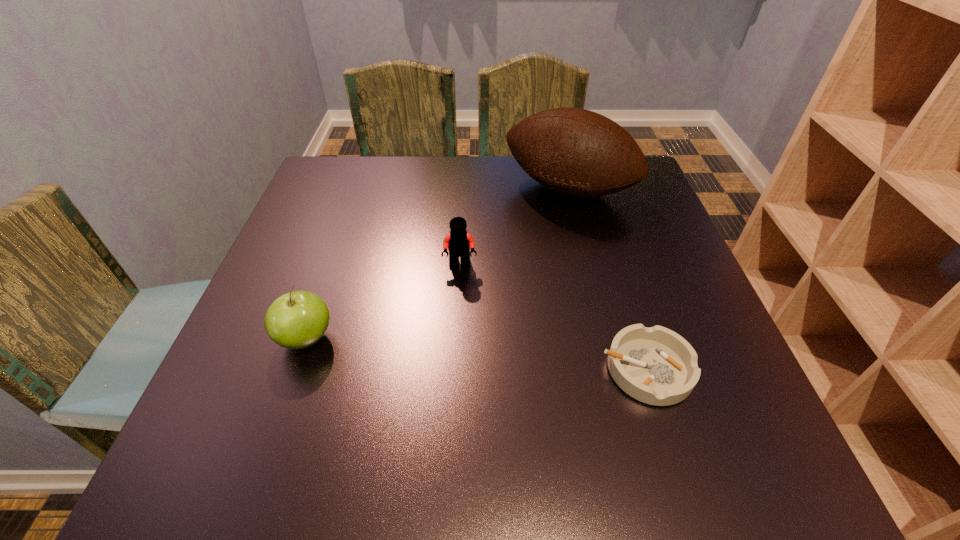
Identify the location of vacant position located on the laces of the farthest object. (537, 224).

Locate an element on the screen. blank area located on the front-facing side of the third nearest object is located at coordinates (444, 393).

You are a GUI agent. You are given a task and a screenshot of the screen. Output one action in this format:
    pyautogui.click(x=<x>, y=<y>)
    Task: Click on the free space located on the front-facing side of the third nearest object
    This screenshot has height=540, width=960.
    Given the screenshot: What is the action you would take?
    pyautogui.click(x=450, y=349)

Locate an element on the screen. free space located 0.310m on the front-facing side of the third nearest object is located at coordinates [444, 403].

Find the location of a particular element. The image size is (960, 540). object that is at the far edge is located at coordinates (576, 152).

At what (x,y) coordinates should I click in order to perform the action: click on object located at the near edge. Please return your answer as a coordinate pair (x, y). Looking at the image, I should click on (x=657, y=366).

Image resolution: width=960 pixels, height=540 pixels. In order to click on object that is at the left edge in this screenshot , I will do `click(298, 319)`.

At what (x,y) coordinates should I click in order to perform the action: click on ashtray present at the right edge. Please return your answer as a coordinate pair (x, y). The width and height of the screenshot is (960, 540). Looking at the image, I should click on pos(657,366).

The image size is (960, 540). Identify the location of football located at the right edge. (576, 152).

Identify the location of object that is at the far right corner. This screenshot has width=960, height=540. (576, 152).